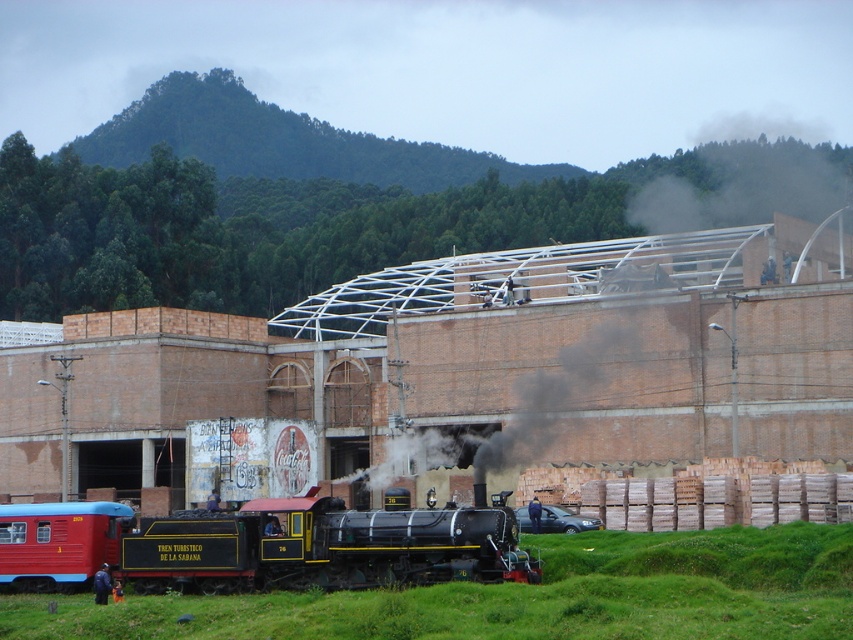
Is point (727, 445) in front of point (26, 572)?

No, it is not.

Is point (753, 296) behind point (509, 531)?

That is True.

What are the coordinates of `black smoke at center` in the screenshot? It's located at (648, 336).